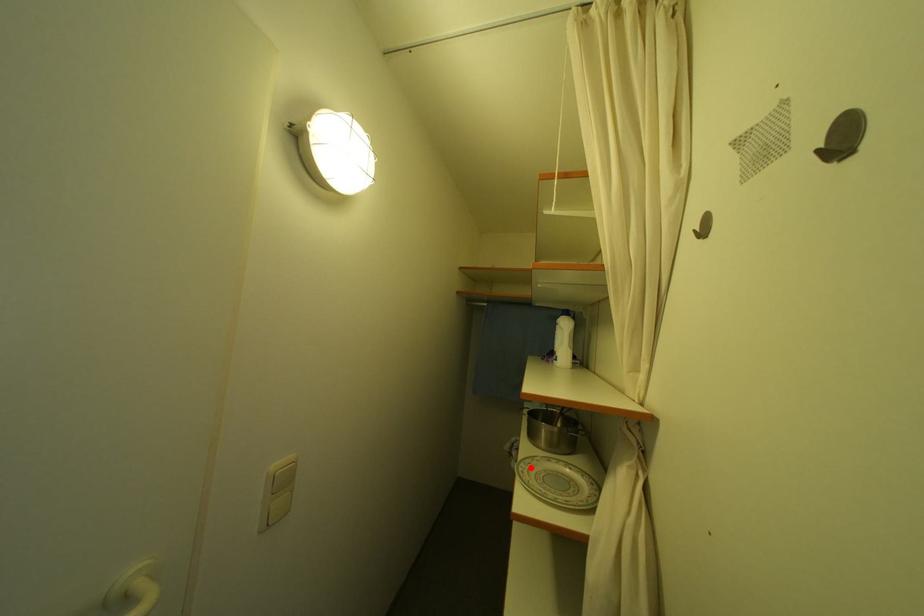
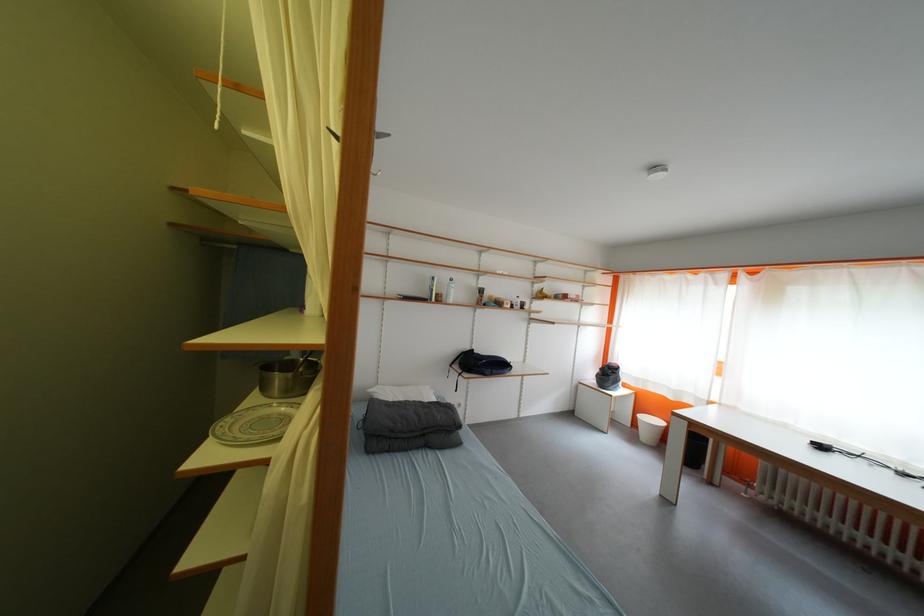
Locate, in the second image, the point that corresponds to the highlighted location in the first image.

(237, 422)